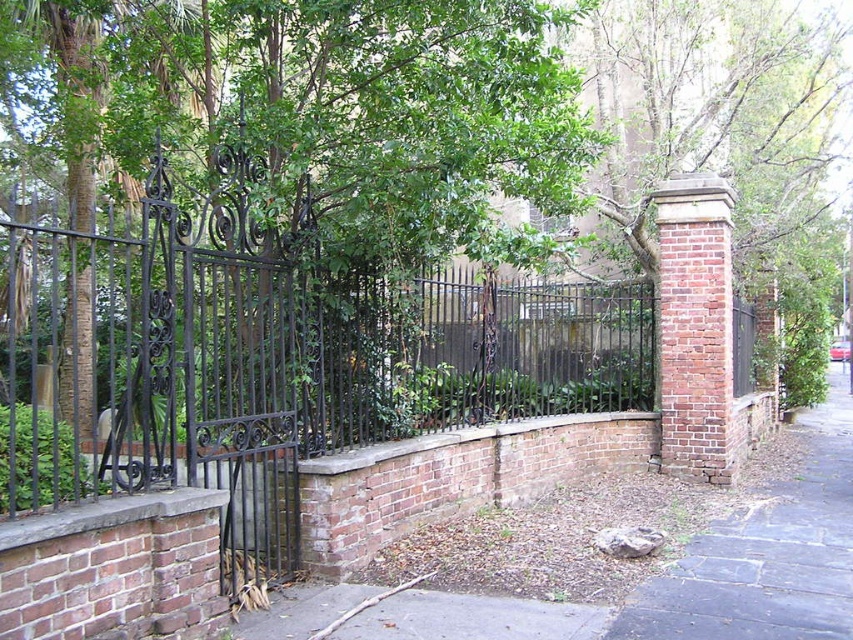
Describe the element at coordinates (345, 369) in the screenshot. I see `black wrought iron fence at center` at that location.

Who is positioned more to the left, black wrought iron fence at center or brown stone pavement at lower right?

From the viewer's perspective, black wrought iron fence at center appears more on the left side.

Between point (694, 426) and point (734, 624), which one is positioned behind?

The point (694, 426) is more distant.

Identify the location of black wrought iron fence at center. (345, 369).